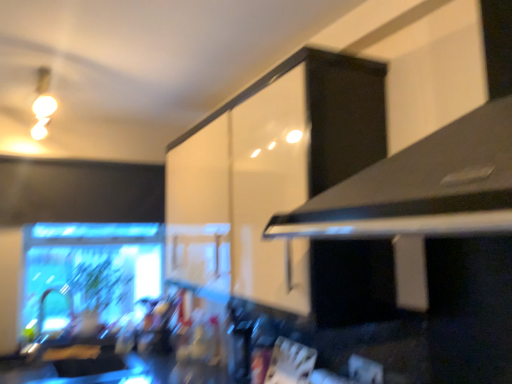
What is the approximate width of black matte exhaust hood at upper right?

It is 22.06 inches.

Locate an element on the screen. white glossy cabinet at upper center is located at coordinates (282, 189).

Is white glossy cabinet at upper center at the left side of matte white bulb at upper left?

Incorrect, white glossy cabinet at upper center is not on the left side of matte white bulb at upper left.

This screenshot has height=384, width=512. Identify the location of cabinetry below the matte white bulb at upper left (from the image's perspective). coord(282,189).

Is white glossy cabinet at upper center in front of or behind matte white bulb at upper left in the image?

Visually, white glossy cabinet at upper center is located in front of matte white bulb at upper left.

From the image's perspective, relative to matte white bulb at upper left, is white glossy cabinet at upper center above or below?

white glossy cabinet at upper center is below matte white bulb at upper left.

Is white glossy cabinet at upper center with black matte exhaust hood at upper right?

They are not placed beside each other.

From the picture: From the image's perspective, who appears lower, white glossy cabinet at upper center or black matte exhaust hood at upper right?

white glossy cabinet at upper center is shown below in the image.

Is white glossy cabinet at upper center smaller than black matte exhaust hood at upper right?

Incorrect, white glossy cabinet at upper center is not smaller in size than black matte exhaust hood at upper right.

Find the location of a particular element. exhaust hood in front of the white glossy cabinet at upper center is located at coordinates (421, 187).

Which object is positioned more to the right, matte white bulb at upper left or black matte exhaust hood at upper right?

black matte exhaust hood at upper right.

How far apart are matte white bulb at upper left and black matte exhaust hood at upper right?

The distance of matte white bulb at upper left from black matte exhaust hood at upper right is 1.70 meters.

Who is shorter, matte white bulb at upper left or black matte exhaust hood at upper right?

matte white bulb at upper left.

Can you tell me how much matte white bulb at upper left and black matte exhaust hood at upper right differ in facing direction?

88.6 degrees separate the facing orientations of matte white bulb at upper left and black matte exhaust hood at upper right.

What's the angular difference between black matte exhaust hood at upper right and matte white bulb at upper left's facing directions?

88.6 degrees.

From a real-world perspective, who is located higher, black matte exhaust hood at upper right or matte white bulb at upper left?

In real-world perspective, matte white bulb at upper left is above.

From the image's perspective, is black matte exhaust hood at upper right above matte white bulb at upper left?

No.

Would you say black matte exhaust hood at upper right contains matte white bulb at upper left?

No, matte white bulb at upper left is located outside of black matte exhaust hood at upper right.

Does black matte exhaust hood at upper right turn towards white glossy cabinet at upper center?

No, black matte exhaust hood at upper right is not turned towards white glossy cabinet at upper center.

Choose the correct answer: Is black matte exhaust hood at upper right inside white glossy cabinet at upper center or outside it?

black matte exhaust hood at upper right cannot be found inside white glossy cabinet at upper center.

The image size is (512, 384). What are the coordinates of `cabinetry lying below the black matte exhaust hood at upper right (from the image's perspective)` in the screenshot? It's located at (282, 189).

Could you tell me if matte white bulb at upper left is turned towards white glossy cabinet at upper center?

No.

Considering the relative positions of matte white bulb at upper left and white glossy cabinet at upper center in the image provided, is matte white bulb at upper left to the left or to the right of white glossy cabinet at upper center?

matte white bulb at upper left is to the left of white glossy cabinet at upper center.

Is matte white bulb at upper left in front of or behind white glossy cabinet at upper center in the image?

Visually, matte white bulb at upper left is located behind white glossy cabinet at upper center.

Find the location of a particular element. light fixture above the white glossy cabinet at upper center (from the image's perspective) is located at coordinates (42, 103).

You are a GUI agent. You are given a task and a screenshot of the screen. Output one action in this format:
    pyautogui.click(x=<x>, y=<y>)
    Task: Click on the exhaust hood in front of the white glossy cabinet at upper center
    This screenshot has width=512, height=384.
    Given the screenshot: What is the action you would take?
    (421, 187)

From the image, which object appears to be nearer to white glossy cabinet at upper center, black matte exhaust hood at upper right or matte white bulb at upper left?

Based on the image, black matte exhaust hood at upper right appears to be nearer to white glossy cabinet at upper center.

When comparing their distances from black matte exhaust hood at upper right, does matte white bulb at upper left or white glossy cabinet at upper center seem further?

The object further to black matte exhaust hood at upper right is matte white bulb at upper left.

Estimate the real-world distances between objects in this image. Which object is closer to matte white bulb at upper left, white glossy cabinet at upper center or black matte exhaust hood at upper right?

The object closer to matte white bulb at upper left is white glossy cabinet at upper center.

Based on their spatial positions, is black matte exhaust hood at upper right or white glossy cabinet at upper center further from matte white bulb at upper left?

black matte exhaust hood at upper right.

Which object lies nearer to the anchor point black matte exhaust hood at upper right, white glossy cabinet at upper center or matte white bulb at upper left?

white glossy cabinet at upper center.

Considering their positions, is matte white bulb at upper left positioned closer to white glossy cabinet at upper center than black matte exhaust hood at upper right?

black matte exhaust hood at upper right.

You are a GUI agent. You are given a task and a screenshot of the screen. Output one action in this format:
    pyautogui.click(x=<x>, y=<y>)
    Task: Click on the cabinetry situated between matte white bulb at upper left and black matte exhaust hood at upper right from left to right
    
    Given the screenshot: What is the action you would take?
    pyautogui.click(x=282, y=189)